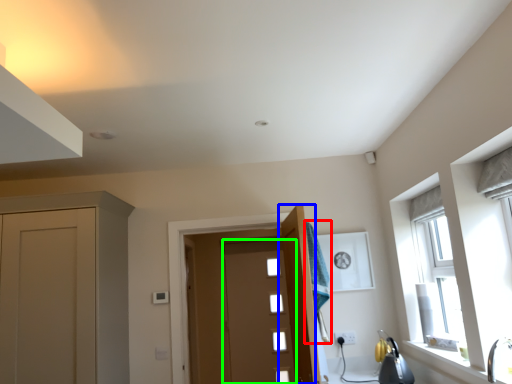
Question: Which object is positioned farthest from laundry (highlighted by a red box)? Select from door (highlighted by a blue box) and door (highlighted by a green box).

Choices:
 (A) door
 (B) door

Answer: (B)